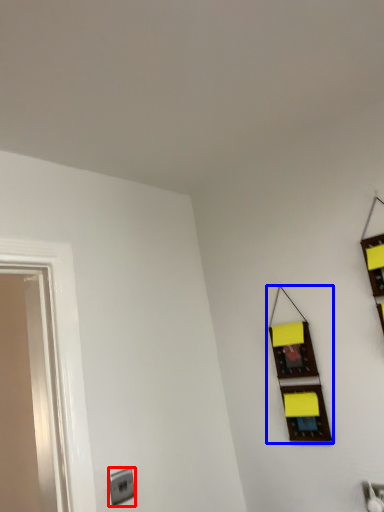
Question: Which of the following is the closest to the observer, electric outlet (highlighted by a red box) or window (highlighted by a blue box)?

Choices:
 (A) electric outlet
 (B) window

Answer: (A)